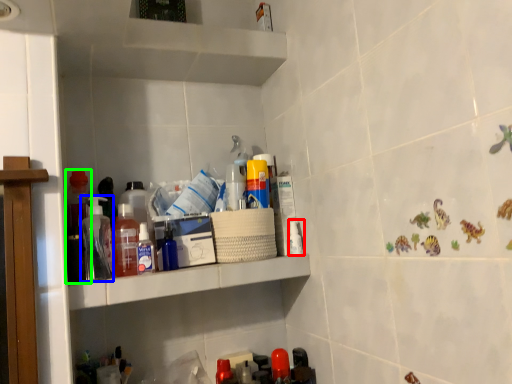
Question: Considering the real-world distances, which object is farthest from toiletry (highlighted by a red box)? bottle (highlighted by a blue box) or bottle (highlighted by a green box)?

Choices:
 (A) bottle
 (B) bottle

Answer: (B)